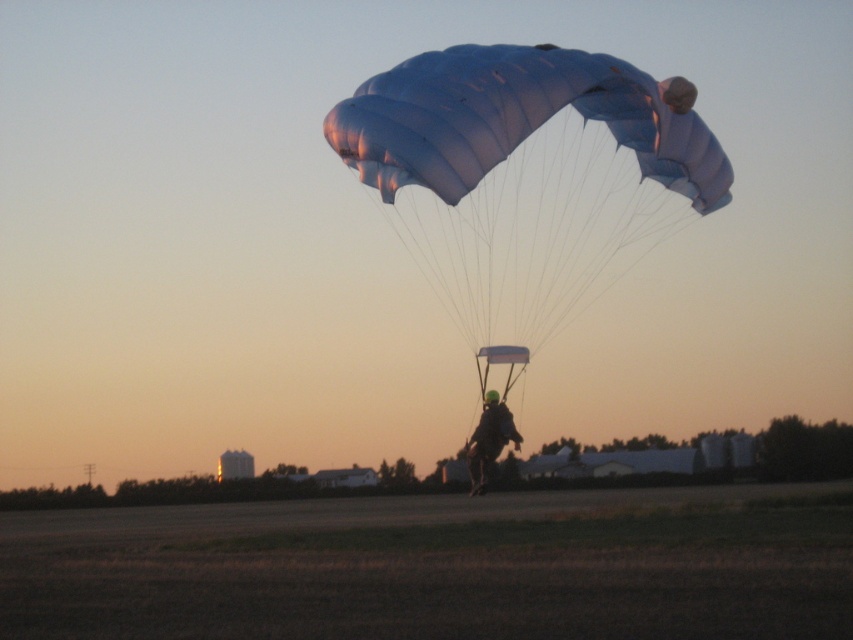
Question: Which point is closer to the camera?

Choices:
 (A) translucent nylon parachute at upper center
 (B) matte black helmet at center

Answer: (A)

Question: Which of the following is the closest to the observer?

Choices:
 (A) translucent nylon parachute at upper center
 (B) matte black helmet at center

Answer: (A)

Question: Is translucent nylon parachute at upper center wider than matte black helmet at center?

Choices:
 (A) no
 (B) yes

Answer: (B)

Question: Is translucent nylon parachute at upper center bigger than matte black helmet at center?

Choices:
 (A) no
 (B) yes

Answer: (B)

Question: Which point is farther to the camera?

Choices:
 (A) matte black helmet at center
 (B) translucent nylon parachute at upper center

Answer: (A)

Question: Where is translucent nylon parachute at upper center located in relation to matte black helmet at center in the image?

Choices:
 (A) left
 (B) right

Answer: (B)